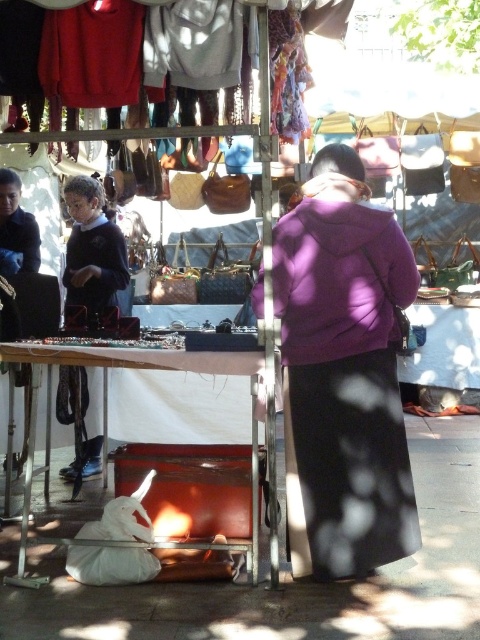
Question: Observing the image, what is the correct spatial positioning of purple matte jacket at center in reference to white leather table at lower center?

Choices:
 (A) below
 (B) above

Answer: (B)

Question: Which point is farther from the camera taking this photo?

Choices:
 (A) click(300, 461)
 (B) click(191, 355)

Answer: (A)

Question: Is the position of purple matte jacket at center less distant than that of white leather table at lower center?

Choices:
 (A) no
 (B) yes

Answer: (A)

Question: Can you confirm if purple matte jacket at center is positioned to the right of white leather table at lower center?

Choices:
 (A) yes
 (B) no

Answer: (A)

Question: Which point appears farthest from the camera in this image?

Choices:
 (A) (351, 387)
 (B) (81, 356)

Answer: (A)